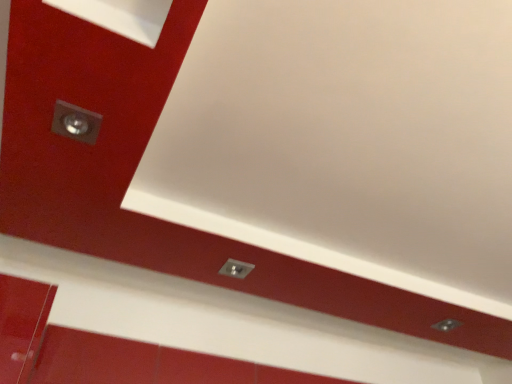
Question: Should I look upward or downward to see metallic silver knob at center?

Choices:
 (A) down
 (B) up

Answer: (A)